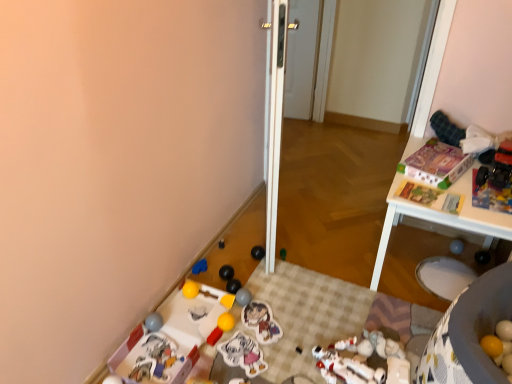
I want to click on free area in between yellow matte toy at lower center, which is counted as the eighth toy, starting from the left, and white matte robot at lower center, the 15th toy viewed from the left, so click(278, 332).